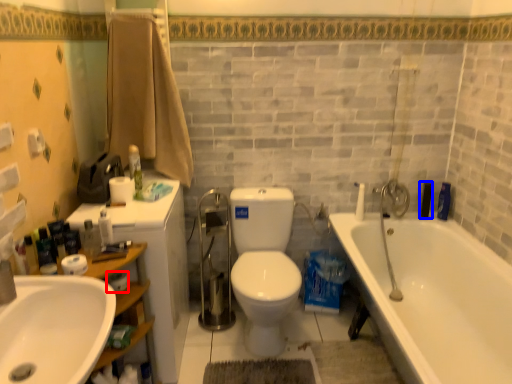
Question: Among these objects, which one is farthest to the camera, toilet paper (highlighted by a red box) or toiletry (highlighted by a blue box)?

Choices:
 (A) toilet paper
 (B) toiletry

Answer: (B)